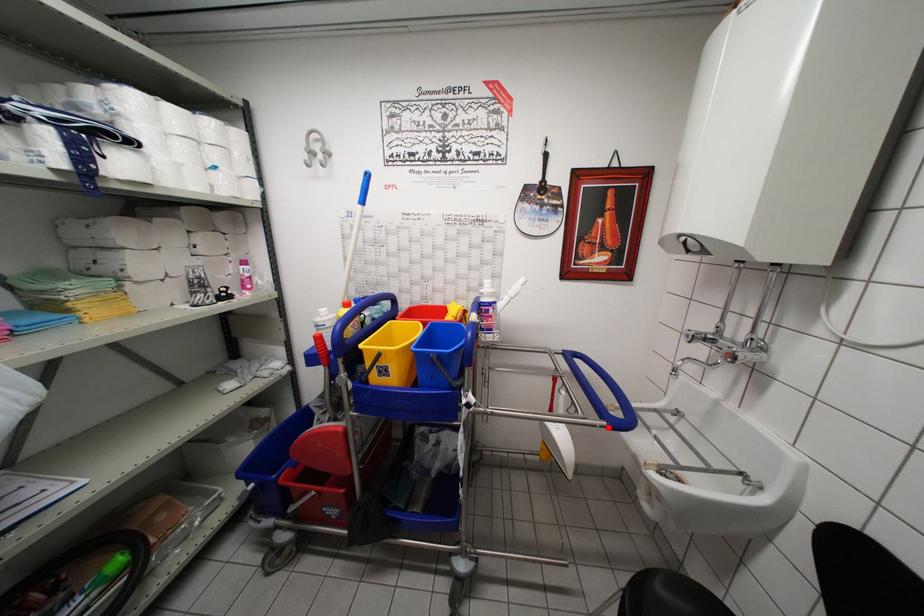
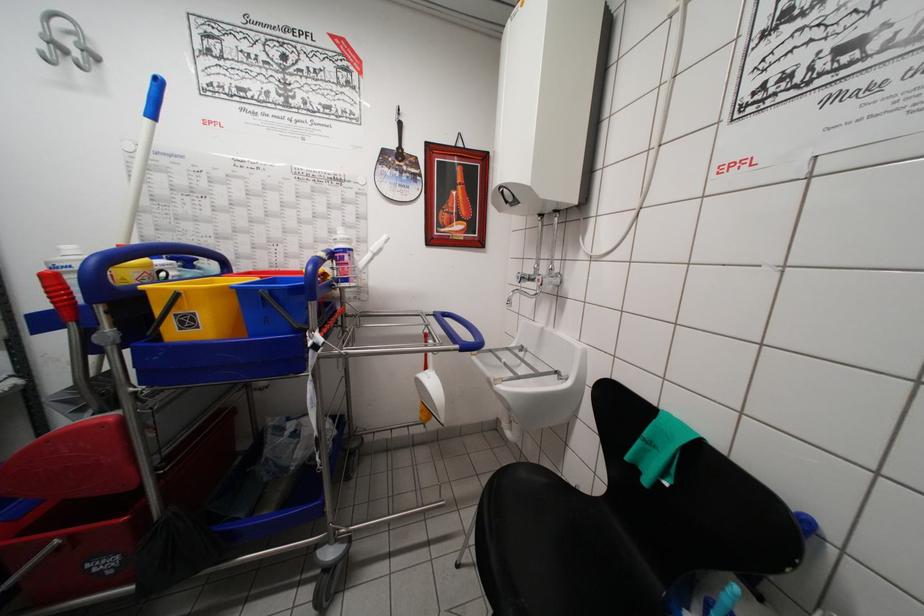
Find the pixel in the second image that matches the highlighted location in the first image.

(460, 351)